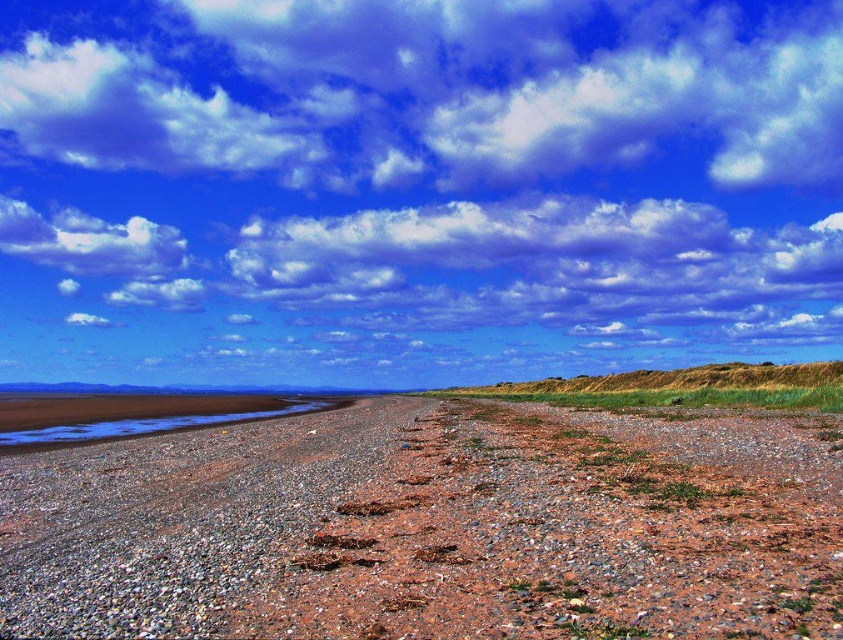
You are standing at the center of the beach and see two points marked on the ground. The first point is at coordinate point (549, 140), and the second is at point (481, 436). Which point is closer to you?

Point (549, 140) is further to the camera than point (481, 436), so the second point is closer to you.

You are standing on the beach and looking towards the horizon. Which object, the cloudy blue sky at upper center or the brown gravel at center, is located to the right of the other?

The cloudy blue sky at upper center is positioned on the left side of brown gravel at center, meaning the brown gravel at center is to the right of the cloudy blue sky at upper center.

You are standing on the beach and looking towards the cloudy blue sky at upper center. Which object is directly above the brown gravel at center?

The cloudy blue sky at upper center is directly above the brown gravel at center.